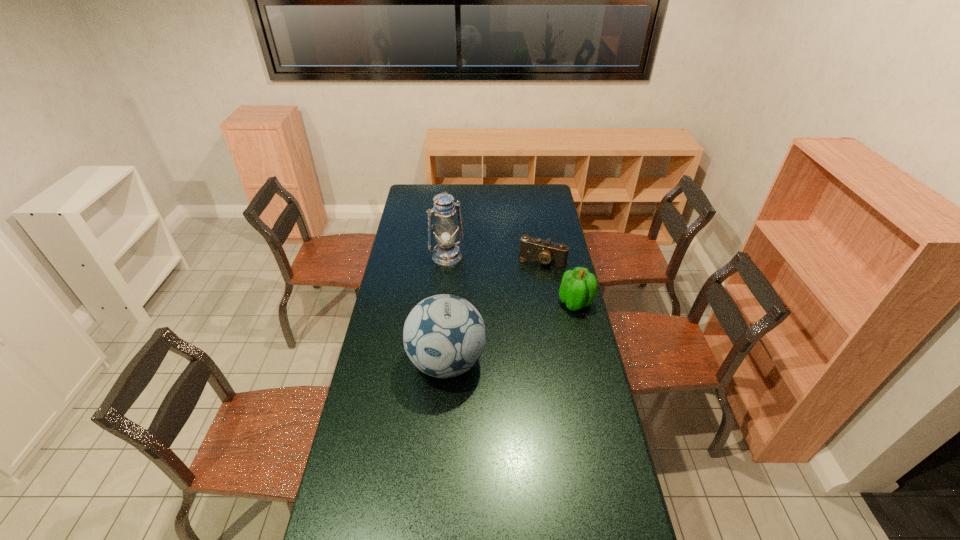
Find the location of a particular element. soccer ball is located at coordinates (444, 335).

Find the location of a particular element. The height and width of the screenshot is (540, 960). the second tallest object is located at coordinates (444, 335).

Find the location of `bell pepper`. bell pepper is located at coordinates (578, 289).

Image resolution: width=960 pixels, height=540 pixels. I want to click on the second nearest object, so click(578, 289).

This screenshot has height=540, width=960. Find the location of `the tallest object`. the tallest object is located at coordinates (446, 253).

This screenshot has width=960, height=540. In order to click on camera in this screenshot , I will do `click(547, 252)`.

You are a GUI agent. You are given a task and a screenshot of the screen. Output one action in this format:
    pyautogui.click(x=<x>, y=<y>)
    Task: Click on the free region located on the side with brand of the second tallest object
    The width and height of the screenshot is (960, 540).
    Given the screenshot: What is the action you would take?
    pyautogui.click(x=438, y=485)

The image size is (960, 540). I want to click on vacant space located on the left of the third tallest object, so click(474, 302).

At what (x,y) coordinates should I click in order to perform the action: click on vacant space located 0.300m on the front-facing side of the tallest object. Please return your answer as a coordinate pair (x, y). Looking at the image, I should click on 482,302.

This screenshot has height=540, width=960. What are the coordinates of `vacant area located on the front-facing side of the tallest object` in the screenshot? It's located at (465, 279).